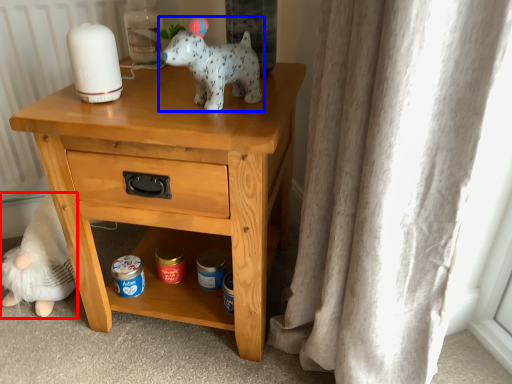
Question: Which object appears closest to the camera in this image, figurine (highlighted by a red box) or toy (highlighted by a blue box)?

Choices:
 (A) figurine
 (B) toy

Answer: (B)